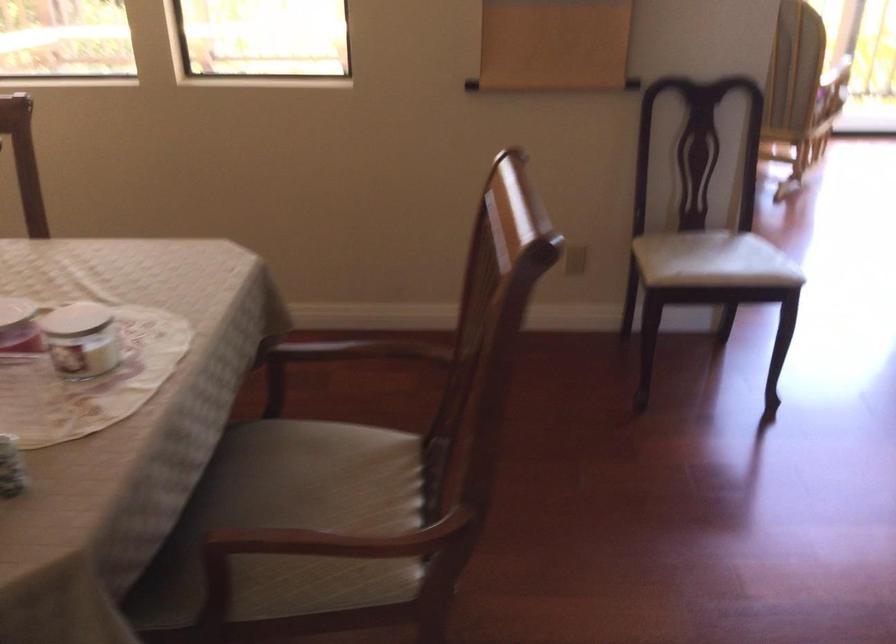
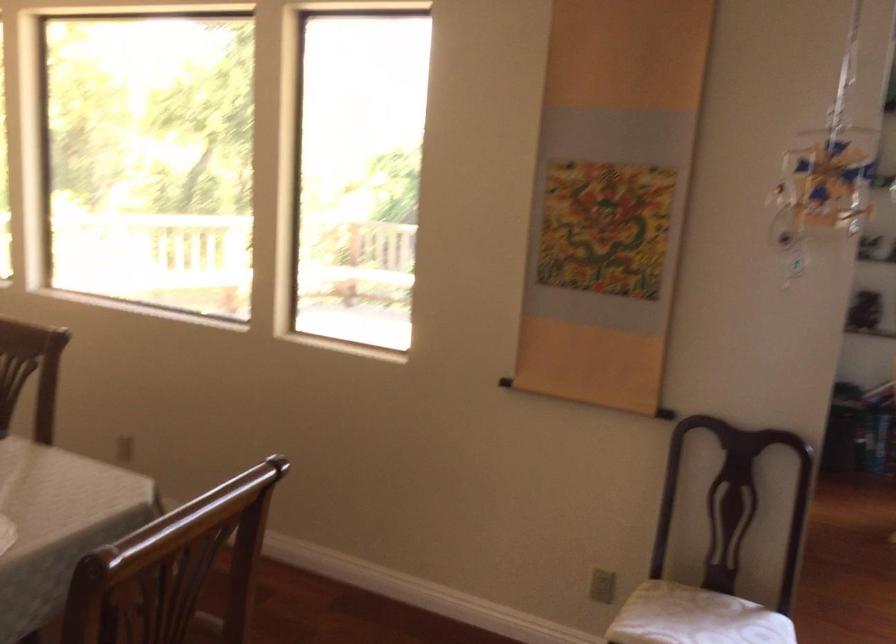
In the second image, find the point that corresponds to pixel 679 250 in the first image.

(668, 614)